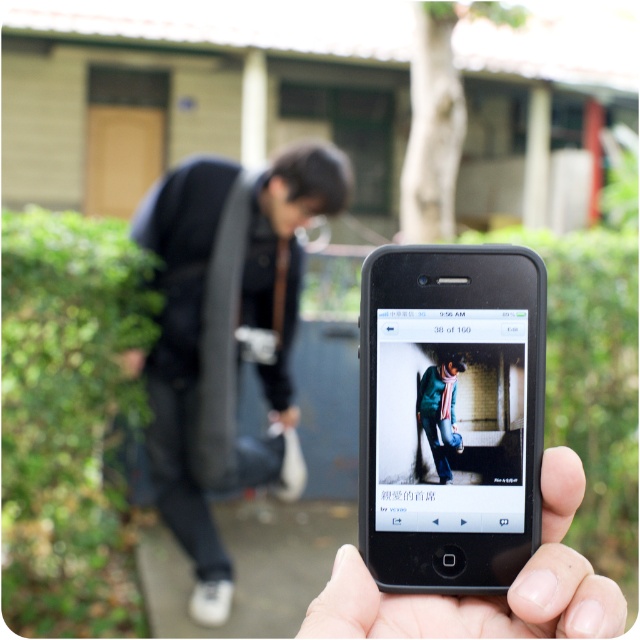
You are looking at the image and notice two points marked in the scene. The first point is at coordinate point (291, 195) and the second is at point (444, 413). Which point is closer to you as the observer?

Point (291, 195) is closer to you than point (444, 413) because it is further to the camera, meaning it is nearer to the observer.

You are organizing a charity clothing drive and need to decide which items to prioritize based on their size. You have a black fabric bag at left and a green woolen sweater at center. Which item should you choose if you need to transport larger items first?

The black fabric bag at left is larger in size than the green woolen sweater at center, so you should prioritize transporting the black fabric bag at left first.